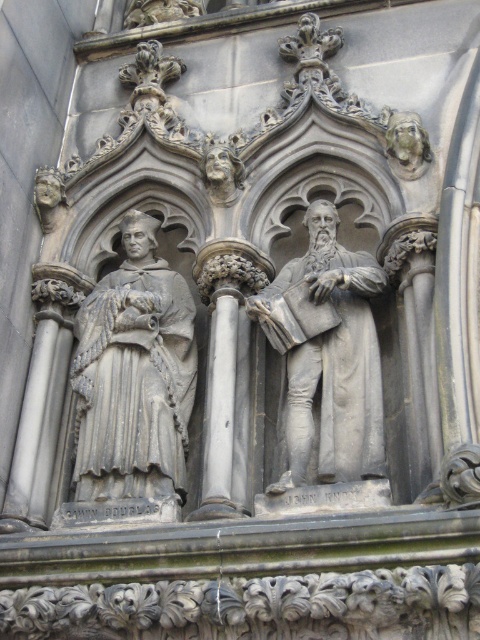
You are an art conservator examining the stone relief. You need to clean both the gray stone column at center and the gray stone pillar at left. Which object should you clean first if you want to start with the one closer to you?

The gray stone column at center is closer to the viewer than the gray stone pillar at left, so you should clean the gray stone column at center first.

You are an art conservator examining the stone relief. You need to determine if the gray stone statue at center can be placed on top of the gray stone pillar at left without exceeding its height. Can it fit?

The gray stone statue at center is taller than the gray stone pillar at left, so placing it on top would exceed the pillar height and not fit properly.

You are an art conservator examining the stone relief. You need to place a protective barrier around both the gray stone statue at center and the gray stone column at center. Since the statue is wider, which object requires a larger barrier to fully cover its width?

The gray stone statue at center requires a larger barrier because its width is greater than the gray stone column at center.